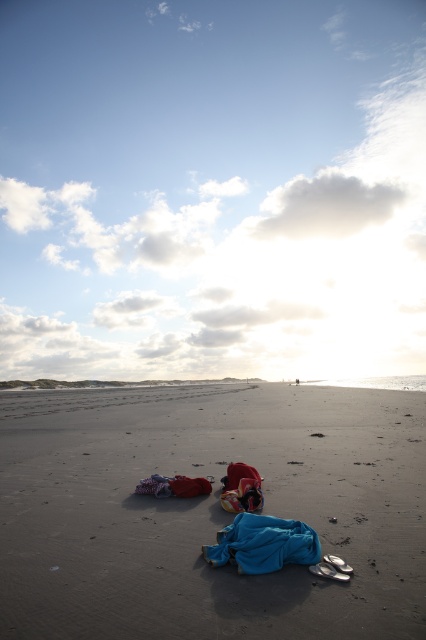
Does smooth sand at center have a lesser width compared to blue cotton blanket at center?

No.

Can you confirm if smooth sand at center is smaller than blue cotton blanket at center?

No.

What are the coordinates of `smooth sand at center` in the screenshot? It's located at (209, 512).

Between smooth sand at center and blue fabric at center, which one is positioned lower?

smooth sand at center is below.

Who is more forward, (186,636) or (261,552)?

Positioned in front is point (186,636).

Find the location of a particular element. The width and height of the screenshot is (426, 640). smooth sand at center is located at coordinates (209, 512).

Does blue fabric at center have a larger size compared to blue cotton blanket at center?

Yes.

This screenshot has width=426, height=640. I want to click on blue fabric at center, so click(262, 544).

Identify the location of blue fabric at center. (262, 544).